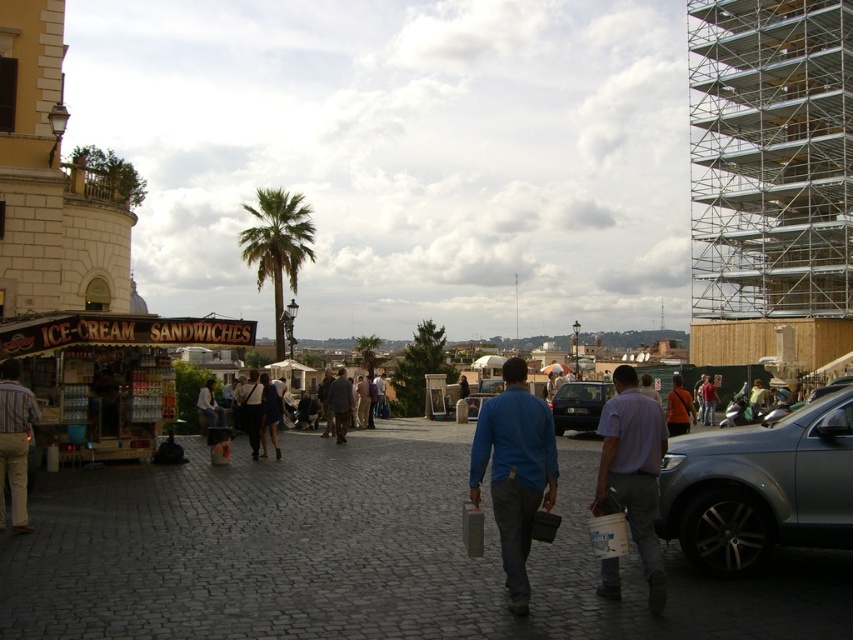
Question: Observing the image, what is the correct spatial positioning of silver metallic car at right in reference to wooden ice cream stand at left?

Choices:
 (A) left
 (B) right

Answer: (B)

Question: Does dark blue shirt at center come behind blue cotton shirt at center?

Choices:
 (A) no
 (B) yes

Answer: (A)

Question: Among these objects, which one is nearest to the camera?

Choices:
 (A) light blue shirt at center
 (B) green leafy palm tree at upper left

Answer: (A)

Question: Which point is farther from the camera taking this photo?

Choices:
 (A) (682, 509)
 (B) (59, 317)
 (C) (347, 385)

Answer: (C)

Question: Which object is positioned closest to the green leafy palm tree at center?

Choices:
 (A) silver metallic car at right
 (B) green leafy palm tree at upper left
 (C) wooden ice cream stand at left

Answer: (B)

Question: In this image, where is striped cotton shirt at left located relative to dark blue shirt at center?

Choices:
 (A) left
 (B) right

Answer: (A)